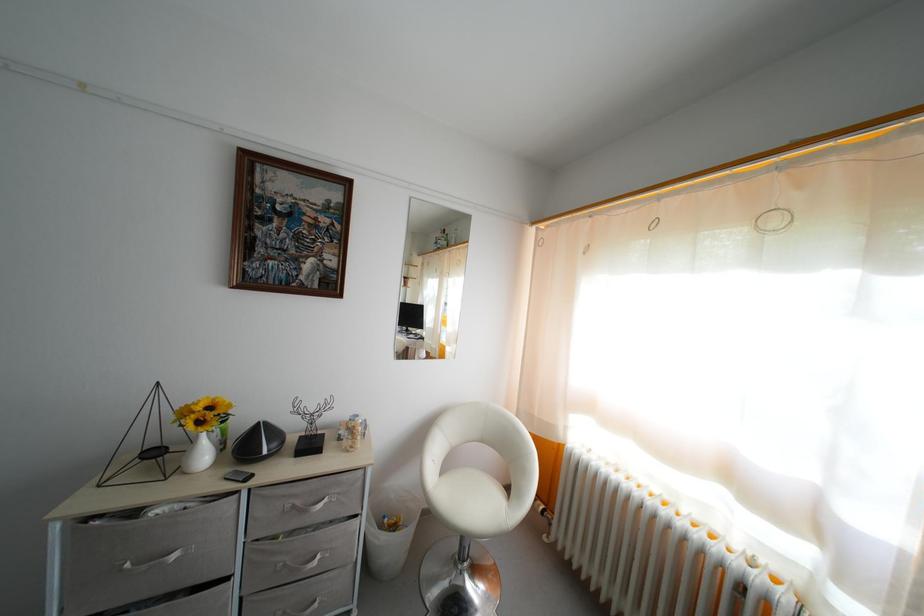
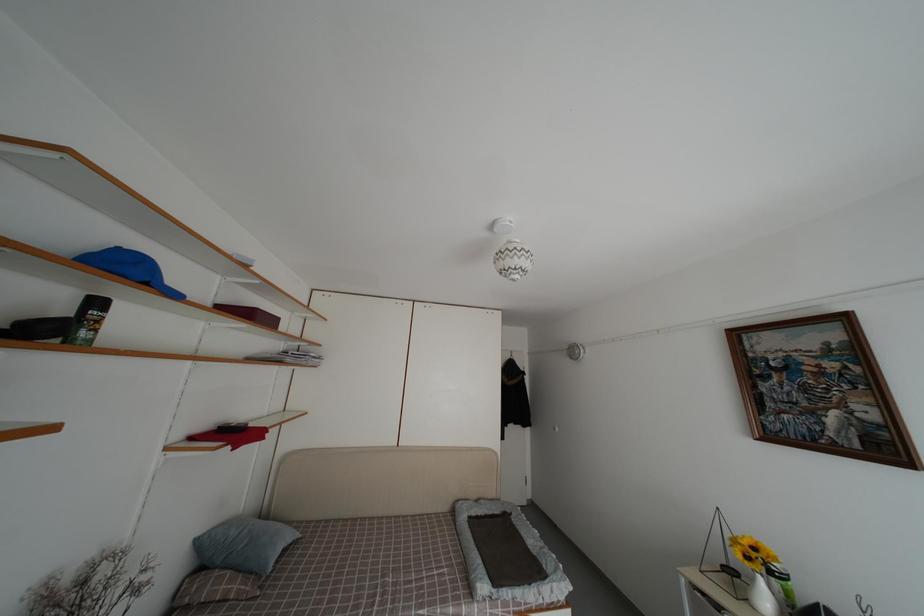
How did the camera likely rotate?

The camera rotated toward left-up.